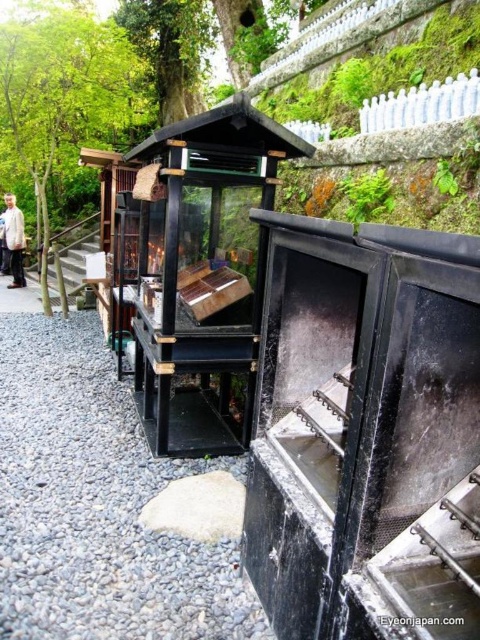
Is gray gravel at lower left bigger than white cotton shirt at left?

Yes, gray gravel at lower left is bigger than white cotton shirt at left.

Which is more to the right, gray gravel at lower left or white cotton shirt at left?

From the viewer's perspective, gray gravel at lower left appears more on the right side.

The width and height of the screenshot is (480, 640). Describe the element at coordinates (96, 504) in the screenshot. I see `gray gravel at lower left` at that location.

Identify the location of gray gravel at lower left. (96, 504).

Which of these two, white cotton shirt at left or gray gravel path at left, stands shorter?

gray gravel path at left is shorter.

Which is behind, point (16, 214) or point (36, 307)?

The point (16, 214) is more distant.

The width and height of the screenshot is (480, 640). Find the location of `white cotton shirt at left`. white cotton shirt at left is located at coordinates (14, 240).

This screenshot has width=480, height=640. Describe the element at coordinates (96, 504) in the screenshot. I see `gray gravel at lower left` at that location.

Between gray gravel at lower left and gray gravel path at left, which one has less height?

With less height is gray gravel path at left.

Find the location of `gray gravel at lower left`. gray gravel at lower left is located at coordinates (96, 504).